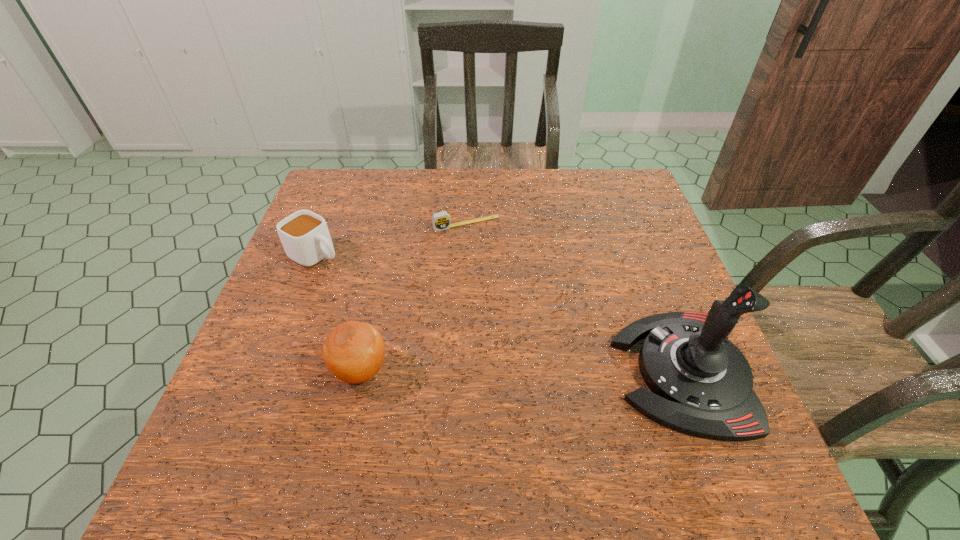
At what (x,y) coordinates should I click in order to perform the action: click on the third object from right to left. Please return your answer as a coordinate pair (x, y). Looking at the image, I should click on (354, 351).

You are a GUI agent. You are given a task and a screenshot of the screen. Output one action in this format:
    pyautogui.click(x=<x>, y=<y>)
    Task: Click on the orange
    This screenshot has width=960, height=540.
    Given the screenshot: What is the action you would take?
    pyautogui.click(x=354, y=351)

Where is `the tallest object`? The height and width of the screenshot is (540, 960). the tallest object is located at coordinates (701, 383).

This screenshot has height=540, width=960. What are the coordinates of `joystick` in the screenshot? It's located at (701, 383).

Identify the location of the second object from right to left. Image resolution: width=960 pixels, height=540 pixels. (441, 221).

The width and height of the screenshot is (960, 540). Identify the location of tape measure. pyautogui.click(x=441, y=221).

At what (x,y) coordinates should I click in order to perform the action: click on cup. Please return your answer as a coordinate pair (x, y). Looking at the image, I should click on (305, 237).

You are a GUI agent. You are given a task and a screenshot of the screen. Output one action in this format:
    pyautogui.click(x=<x>, y=<y>)
    Task: Click on the third nearest object
    
    Given the screenshot: What is the action you would take?
    pyautogui.click(x=305, y=237)

Where is `vacant region located 0.240m on the right of the second tallest object`? vacant region located 0.240m on the right of the second tallest object is located at coordinates (509, 370).

The width and height of the screenshot is (960, 540). Find the location of `vacant space located on the handle side of the joystick`. vacant space located on the handle side of the joystick is located at coordinates (562, 372).